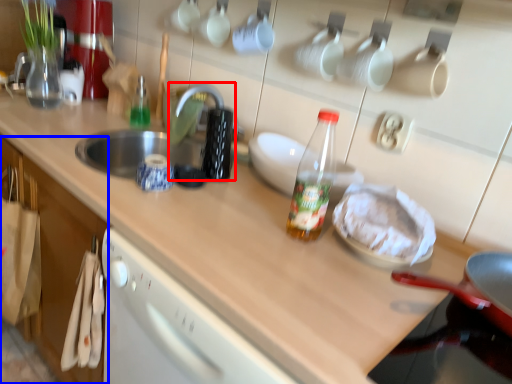
Question: Which of the following is the closest to the observer, faucet (highlighted by a red box) or cabinetry (highlighted by a blue box)?

Choices:
 (A) faucet
 (B) cabinetry

Answer: (B)